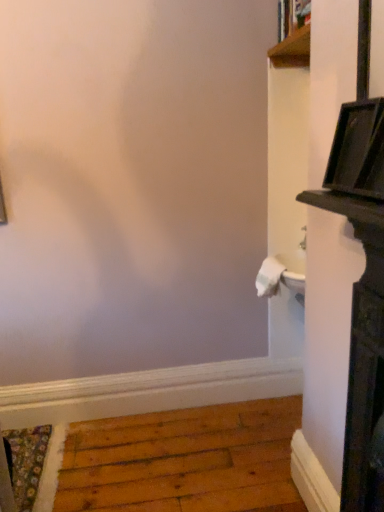
The image size is (384, 512). Describe the element at coordinates (269, 277) in the screenshot. I see `white textured toilet paper at center-right` at that location.

Measure the distance between white textured toilet paper at center-right and camera.

The depth of white textured toilet paper at center-right is 2.00 meters.

At what (x,y) coordinates should I click in order to perform the action: click on white textured toilet paper at center-right. Please return your answer as a coordinate pair (x, y). Looking at the image, I should click on (269, 277).

Where is `white textured toilet paper at center-right`? Image resolution: width=384 pixels, height=512 pixels. white textured toilet paper at center-right is located at coordinates (269, 277).